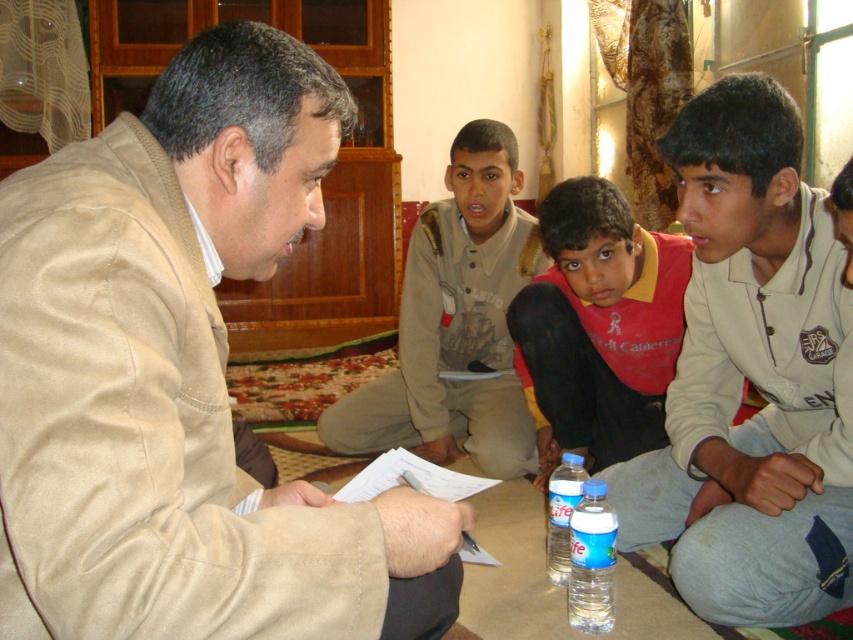
Is point (471, 296) positioned before point (531, 344)?

No, it is not.

Is khaki cotton shirt at center positioned behind red/yellow shirt at center?

Yes, it is behind red/yellow shirt at center.

This screenshot has height=640, width=853. Describe the element at coordinates (456, 323) in the screenshot. I see `khaki cotton shirt at center` at that location.

The height and width of the screenshot is (640, 853). Identify the location of khaki cotton shirt at center. (456, 323).

Is red/yellow shirt at center wider than clear plastic bottle at lower center?

Yes, red/yellow shirt at center is wider than clear plastic bottle at lower center.

Which is behind, point (672, 289) or point (582, 627)?

The point (672, 289) is more distant.

Does point (660, 298) come behind point (604, 589)?

Yes, it is.

Where is `red/yellow shirt at center`? This screenshot has height=640, width=853. red/yellow shirt at center is located at coordinates (598, 326).

Who is positioned more to the right, beige suede jacket at left or clear plastic bottle at lower center?

From the viewer's perspective, clear plastic bottle at lower center appears more on the right side.

Which of these two, beige suede jacket at left or clear plastic bottle at lower center, stands taller?

beige suede jacket at left is taller.

The image size is (853, 640). What are the coordinates of `beige suede jacket at left` in the screenshot? It's located at (183, 378).